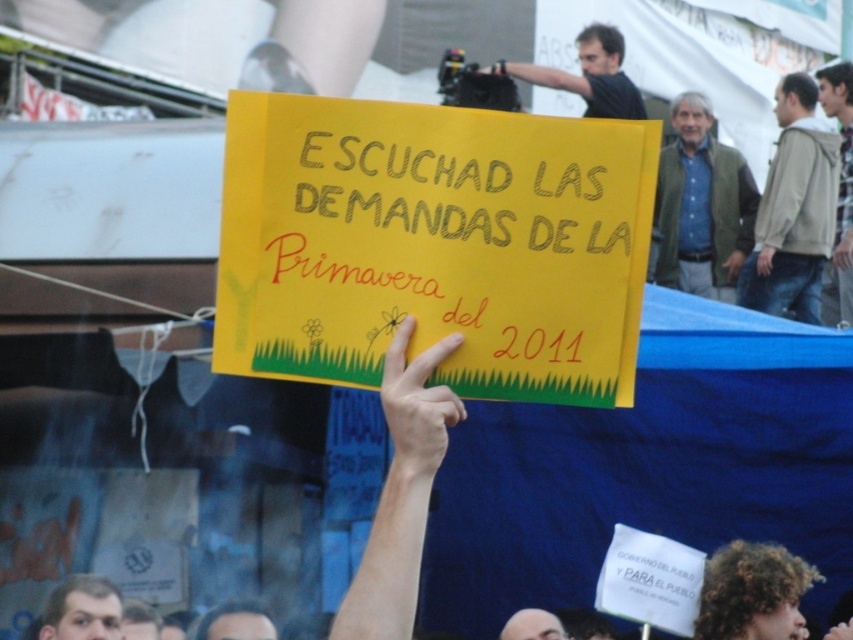
Question: Can you confirm if dark blue shirt at upper center is positioned above bald head at upper center?

Choices:
 (A) yes
 (B) no

Answer: (A)

Question: Estimate the real-world distances between objects in this image. Which object is closer to the dark brown hair at center?

Choices:
 (A) green textured jacket at upper right
 (B) curly hair at upper center
 (C) skinny yellow sign at center

Answer: (B)

Question: Which point is farther to the camera?

Choices:
 (A) dark blue shirt at upper center
 (B) light brown jacket at right
 (C) light brown hair at upper right

Answer: (A)

Question: Is the position of light brown jacket at right more distant than that of dark brown hair at center?

Choices:
 (A) no
 (B) yes

Answer: (B)

Question: Which object is closer to the camera taking this photo?

Choices:
 (A) dark brown hair at center
 (B) light brown hair at upper right
 (C) dark blue shirt at upper center
 (D) light brown jacket at right

Answer: (A)

Question: Does curly hair at upper center come behind skinny yellow sign at center?

Choices:
 (A) yes
 (B) no

Answer: (A)